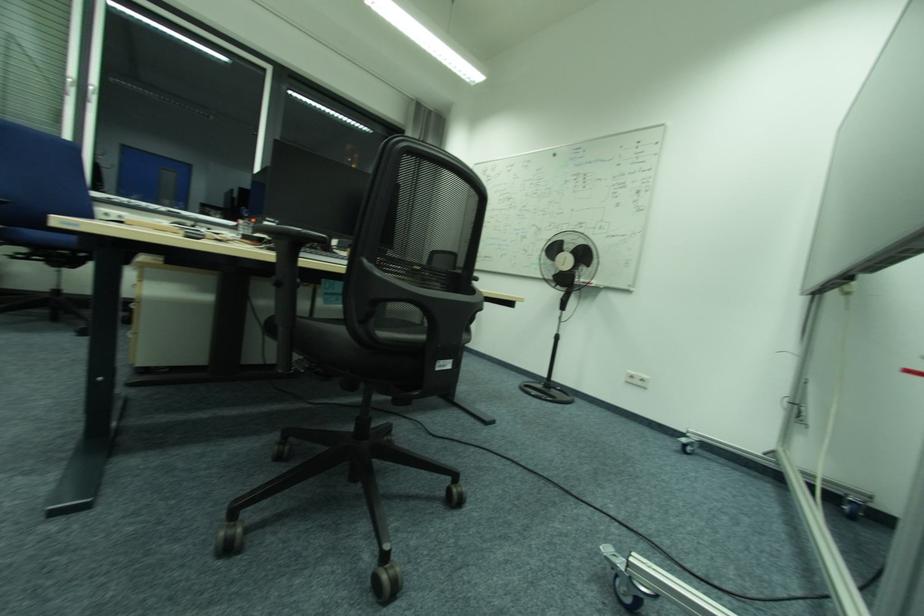
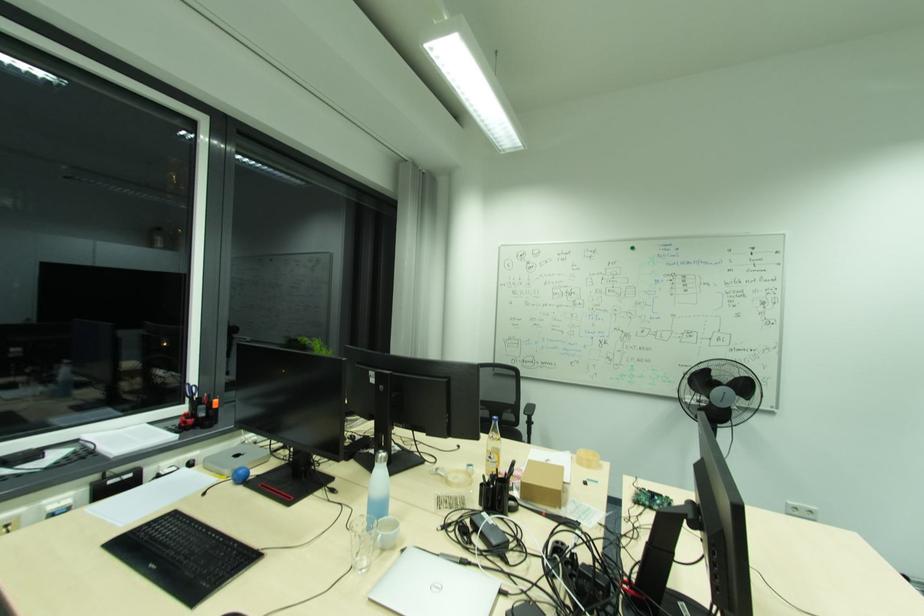
In the second image, find the point that corresponds to (631,373) in the first image.

(794, 506)